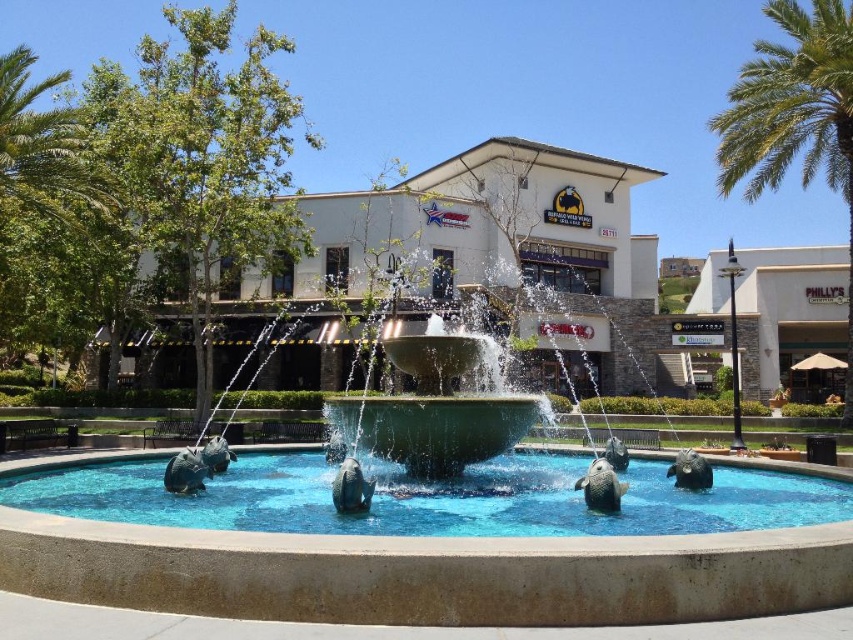
You are a tourist standing in front of the fountain and want to take a photo of both the white stucco building at center and the white stone building at right. Which building should you stand closer to in order to capture both in the same frame?

You should stand closer to the white stucco building at center because it is positioned on the left side of the white stone building at right, so by centering yourself between them, you can include both in your photo.

You are standing at the point with coordinates (469,250) in the image. What is the name of the building located at this point?

The white stucco building at center is located at point (469,250).